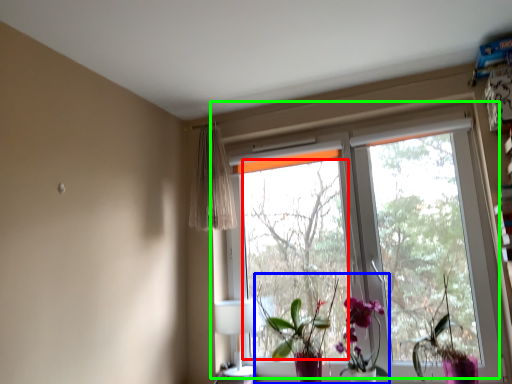
Question: Considering the real-world distances, which object is farthest from tree (highlighted by a red box)? floral arrangement (highlighted by a blue box) or window (highlighted by a green box)?

Choices:
 (A) floral arrangement
 (B) window

Answer: (A)